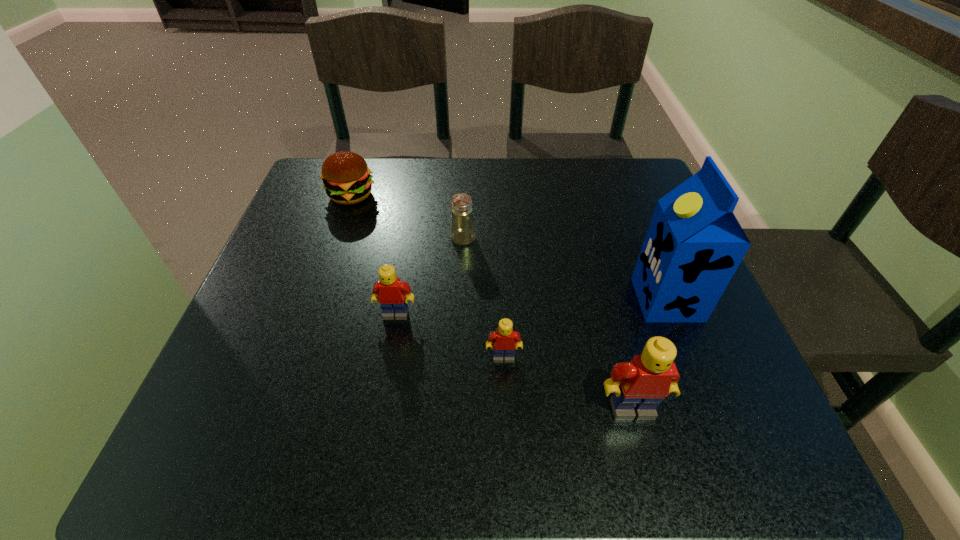
Image resolution: width=960 pixels, height=540 pixels. Find the location of `Lego situated at the right edge`. Lego situated at the right edge is located at coordinates (640, 385).

I want to click on carton that is positioned at the right edge, so click(694, 244).

Find the location of a particular element. The height and width of the screenshot is (540, 960). object that is positioned at the far left corner is located at coordinates (346, 177).

Image resolution: width=960 pixels, height=540 pixels. What are the coordinates of `object that is at the near right corner` in the screenshot? It's located at (640, 385).

The height and width of the screenshot is (540, 960). I want to click on vacant area at the far edge of the desktop, so click(x=569, y=181).

This screenshot has height=540, width=960. I want to click on free space at the left edge of the desktop, so click(x=347, y=251).

Identify the location of free region at the right edge of the desktop. This screenshot has height=540, width=960. (616, 217).

The width and height of the screenshot is (960, 540). I want to click on free space at the near left corner, so click(x=278, y=384).

This screenshot has width=960, height=540. What are the coordinates of `vacant area that lies between the leftmost object and the tallest Lego` in the screenshot? It's located at (492, 302).

Where is `vacant area that lies between the farthest object and the carton`? vacant area that lies between the farthest object and the carton is located at coordinates (509, 247).